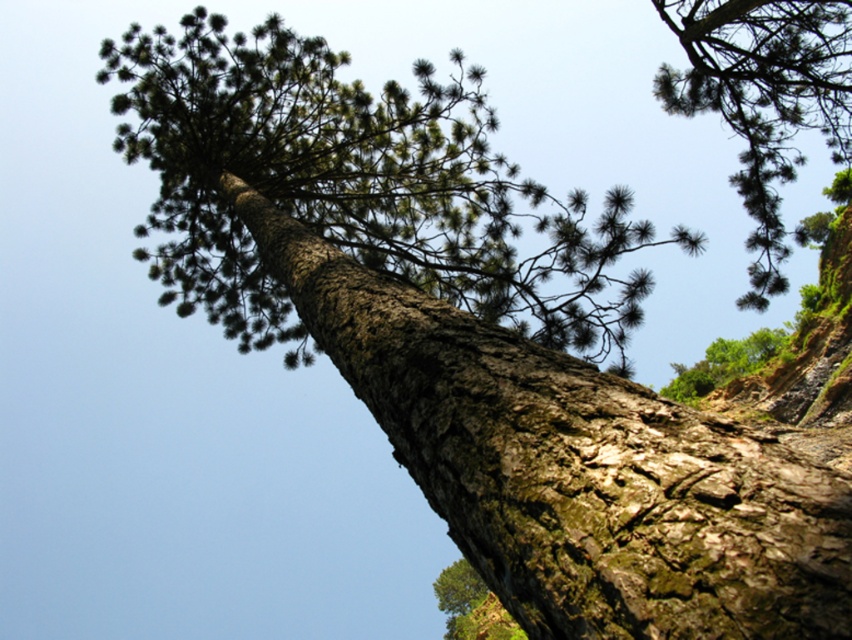
Measure the distance between greenish-brown bark tree trunk at center and green rough bark tree at upper right.

greenish-brown bark tree trunk at center is 9.92 meters away from green rough bark tree at upper right.

Who is more forward, (801, 586) or (747, 182)?

Point (801, 586) is in front.

I want to click on greenish-brown bark tree trunk at center, so click(x=573, y=467).

Between green rough bark tree at upper right and green rough bark tree at center, which one appears on the right side from the viewer's perspective?

green rough bark tree at upper right

Is point (750, 179) closer to viewer compared to point (436, 588)?

Yes.

Which is behind, point (818, 68) or point (455, 570)?

Point (455, 570)

Identify the location of green rough bark tree at upper right. The width and height of the screenshot is (852, 640). (763, 99).

Consider the image. Which of these two, greenish-brown bark tree trunk at center or green rough bark tree at center, stands shorter?

greenish-brown bark tree trunk at center

Does greenish-brown bark tree trunk at center appear over green rough bark tree at center?

Yes.

Which is in front, point (787, 632) or point (487, 593)?

Point (787, 632) is more forward.

Where is `greenish-brown bark tree trunk at center`? This screenshot has height=640, width=852. greenish-brown bark tree trunk at center is located at coordinates (573, 467).